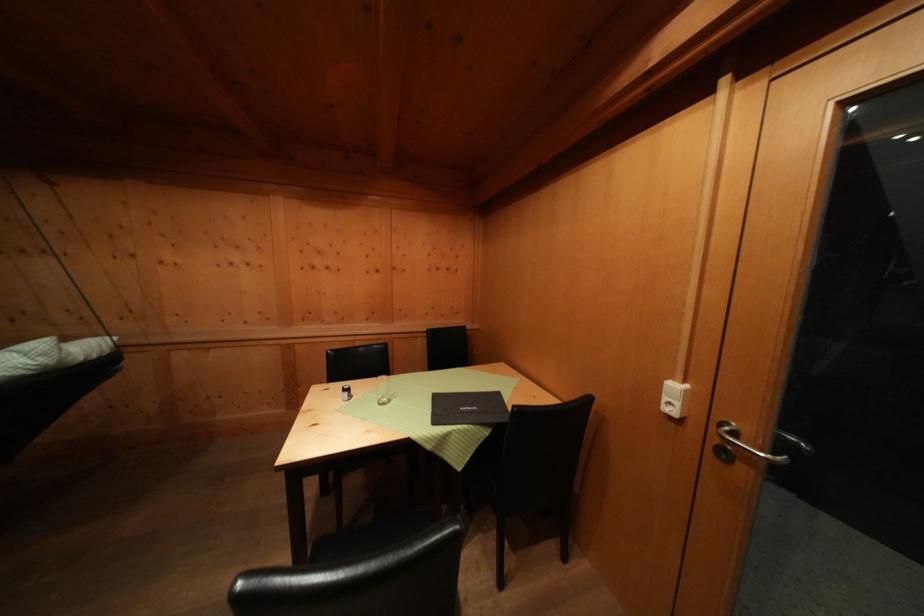
Identify the location of black menu folder. The image size is (924, 616). (468, 408).